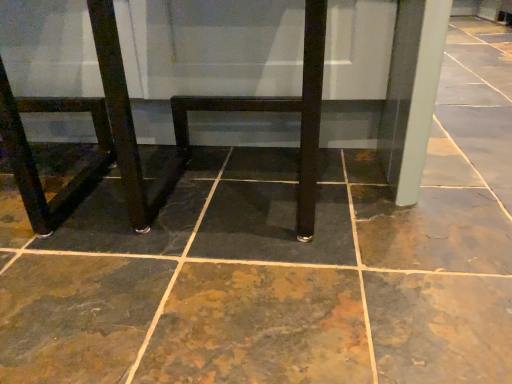
Question: From a real-world perspective, is matte black chair at lower left positioned under matte black table at center based on gravity?

Choices:
 (A) yes
 (B) no

Answer: (B)

Question: From the image's perspective, is matte black chair at lower left on matte black table at center?

Choices:
 (A) yes
 (B) no

Answer: (B)

Question: Does matte black chair at lower left have a smaller size compared to matte black table at center?

Choices:
 (A) yes
 (B) no

Answer: (A)

Question: Is matte black chair at lower left not near matte black table at center?

Choices:
 (A) yes
 (B) no

Answer: (B)

Question: Considering the relative positions of matte black chair at lower left and matte black table at center in the image provided, is matte black chair at lower left to the left of matte black table at center from the viewer's perspective?

Choices:
 (A) yes
 (B) no

Answer: (A)

Question: From a real-world perspective, is matte black chair at lower left above or below matte black table at center?

Choices:
 (A) above
 (B) below

Answer: (A)

Question: Based on their sizes in the image, would you say matte black chair at lower left is bigger or smaller than matte black table at center?

Choices:
 (A) small
 (B) big

Answer: (A)

Question: Considering the positions of point (37, 109) and point (106, 23), is point (37, 109) closer or farther from the camera than point (106, 23)?

Choices:
 (A) closer
 (B) farther

Answer: (B)

Question: In the image, is matte black chair at lower left on the left side or the right side of matte black table at center?

Choices:
 (A) right
 (B) left

Answer: (B)

Question: From a real-world perspective, is brown stone floor at center positioned above or below matte black chair at lower left?

Choices:
 (A) above
 (B) below

Answer: (B)

Question: Is brown stone floor at center wider or thinner than matte black chair at lower left?

Choices:
 (A) thin
 (B) wide

Answer: (B)

Question: Does point (439, 344) appear closer or farther from the camera than point (102, 137)?

Choices:
 (A) farther
 (B) closer

Answer: (B)

Question: Is brown stone floor at center inside or outside of matte black chair at lower left?

Choices:
 (A) inside
 (B) outside

Answer: (B)

Question: Is matte black table at center taller or shorter than brown stone floor at center?

Choices:
 (A) short
 (B) tall

Answer: (B)

Question: From the image's perspective, is matte black table at center located above or below brown stone floor at center?

Choices:
 (A) below
 (B) above

Answer: (B)